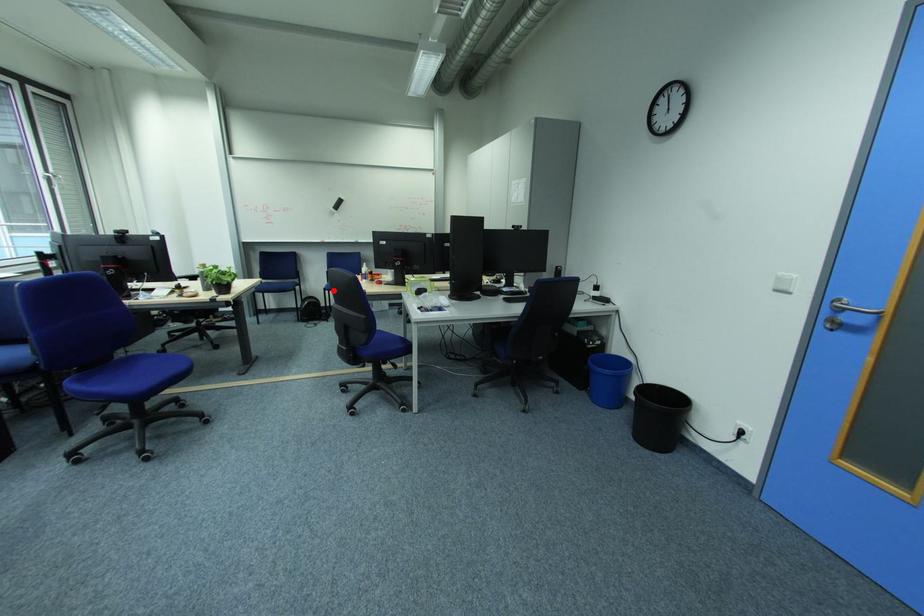
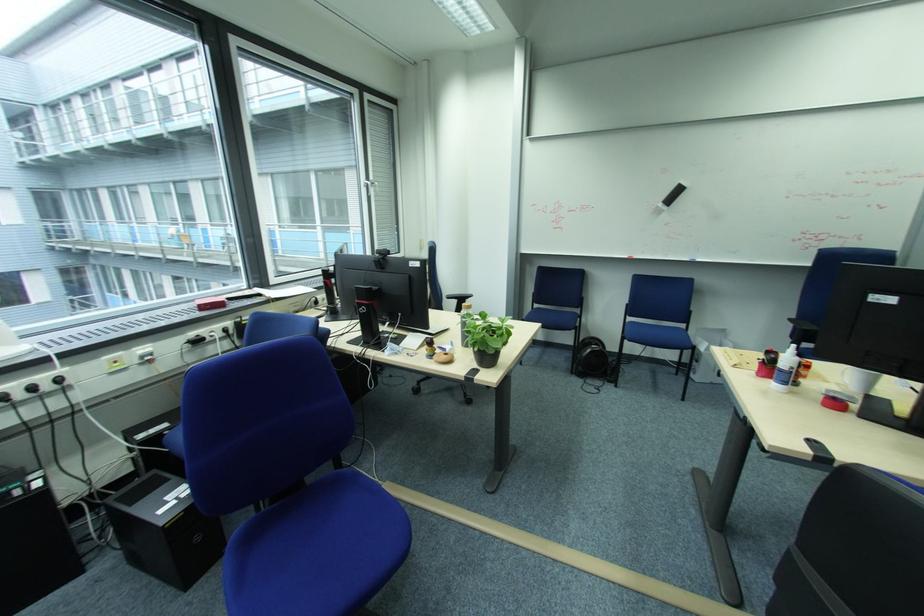
Question: I am providing you with two images of the same scene from different viewpoints. In image1, a red point is highlighted. Considering the same 3D point in image2, which of the following is correct?

Choices:
 (A) It is closer
 (B) It is farther

Answer: (A)